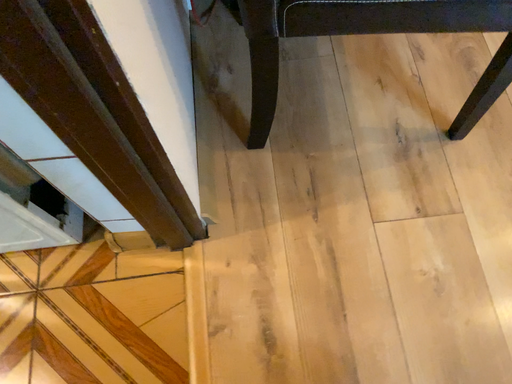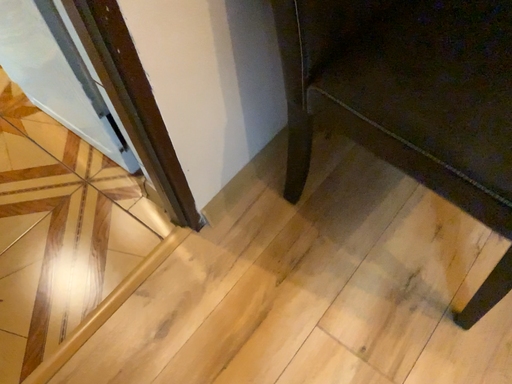
Question: How did the camera likely rotate when shooting the video?

Choices:
 (A) rotated upward
 (B) rotated downward

Answer: (A)